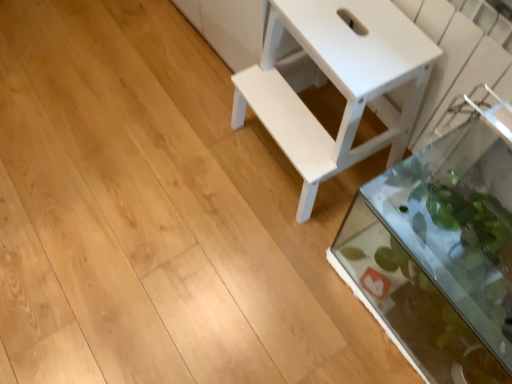
Question: Considering the relative sizes of white matte table at center and transparent glass tank at lower right in the image provided, is white matte table at center smaller than transparent glass tank at lower right?

Choices:
 (A) yes
 (B) no

Answer: (A)

Question: Does white matte table at center turn towards transparent glass tank at lower right?

Choices:
 (A) yes
 (B) no

Answer: (B)

Question: From a real-world perspective, is white matte table at center physically below transparent glass tank at lower right?

Choices:
 (A) yes
 (B) no

Answer: (B)

Question: Is white matte table at center at the right side of transparent glass tank at lower right?

Choices:
 (A) no
 (B) yes

Answer: (A)

Question: Is white matte table at center further to the viewer compared to transparent glass tank at lower right?

Choices:
 (A) yes
 (B) no

Answer: (A)

Question: Is white matte table at center far from transparent glass tank at lower right?

Choices:
 (A) no
 (B) yes

Answer: (A)

Question: Can you confirm if transparent glass tank at lower right is thinner than white matte table at center?

Choices:
 (A) no
 (B) yes

Answer: (B)

Question: Is the position of transparent glass tank at lower right more distant than that of white matte table at center?

Choices:
 (A) yes
 (B) no

Answer: (B)

Question: Is transparent glass tank at lower right wider than white matte table at center?

Choices:
 (A) no
 (B) yes

Answer: (A)

Question: Is transparent glass tank at lower right closer to the viewer compared to white matte table at center?

Choices:
 (A) yes
 (B) no

Answer: (A)

Question: Does transparent glass tank at lower right have a larger size compared to white matte table at center?

Choices:
 (A) yes
 (B) no

Answer: (A)

Question: Is transparent glass tank at lower right directly adjacent to white matte table at center?

Choices:
 (A) no
 (B) yes

Answer: (A)

Question: Is point (293, 92) closer or farther from the camera than point (415, 344)?

Choices:
 (A) closer
 (B) farther

Answer: (B)